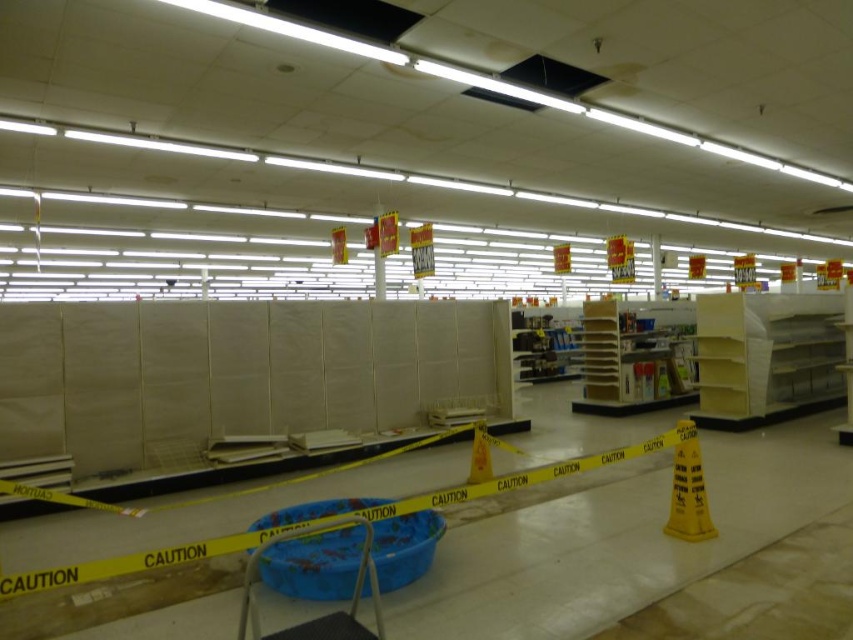
You are a customer entering the store and see the yellow caution cone at lower right and the yellow plastic cone at center. Which cone is closer to the entrance?

The yellow caution cone at lower right is closer to the entrance because it is in front of the yellow plastic cone at center, meaning it is positioned between the entrance and the other cone.

From the picture: What is the spatial relationship between the yellow matte shelf at center and the yellow plastic cone at center from the observer perspective?

The yellow matte shelf at center is closer to the observer than the yellow plastic cone at center.

You are a store employee who needs to place a new item on the highest available surface near the center of the store. You have the option to use either the yellow matte shelf at center or the yellow plastic cone at center. Which one should you choose?

The yellow matte shelf at center has a greater height compared to the yellow plastic cone at center, so you should choose the yellow matte shelf at center as the highest available surface near the center of the store.